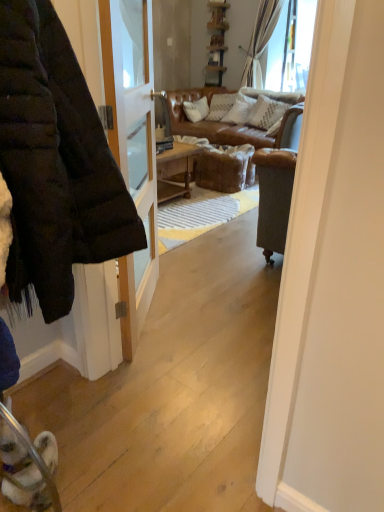
Question: Is there a large distance between matte black jacket at left and white textured pillow at center?

Choices:
 (A) no
 (B) yes

Answer: (B)

Question: Is white textured pillow at center surrounded by matte black jacket at left?

Choices:
 (A) yes
 (B) no

Answer: (B)

Question: From a real-world perspective, is matte black jacket at left on white textured pillow at center?

Choices:
 (A) no
 (B) yes

Answer: (B)

Question: Is matte black jacket at left to the right of white textured pillow at center from the viewer's perspective?

Choices:
 (A) no
 (B) yes

Answer: (A)

Question: Is matte black jacket at left positioned beyond the bounds of white textured pillow at center?

Choices:
 (A) yes
 (B) no

Answer: (A)

Question: Is matte black jacket at left smaller than white textured pillow at center?

Choices:
 (A) no
 (B) yes

Answer: (A)

Question: From the image's perspective, is white textured pillow at center below matte black jacket at left?

Choices:
 (A) no
 (B) yes

Answer: (A)

Question: Would you say white textured pillow at center is outside matte black jacket at left?

Choices:
 (A) yes
 (B) no

Answer: (A)

Question: Can you confirm if white textured pillow at center is wider than matte black jacket at left?

Choices:
 (A) no
 (B) yes

Answer: (A)

Question: From a real-world perspective, is white textured pillow at center beneath matte black jacket at left?

Choices:
 (A) yes
 (B) no

Answer: (A)

Question: Does white textured pillow at center have a greater height compared to matte black jacket at left?

Choices:
 (A) no
 (B) yes

Answer: (A)

Question: Does white textured pillow at center lie in front of matte black jacket at left?

Choices:
 (A) yes
 (B) no

Answer: (B)

Question: From a real-world perspective, is matte black jacket at left above or below white textured pillow at center?

Choices:
 (A) below
 (B) above

Answer: (B)